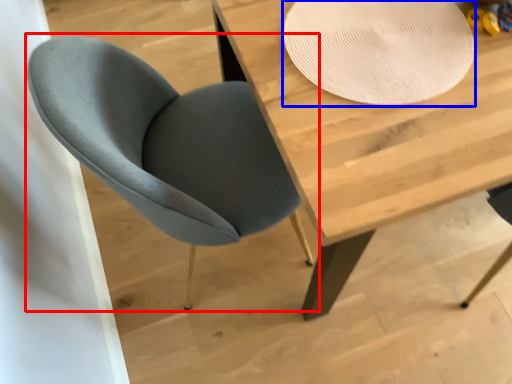
Question: Which object is further to the camera taking this photo, chair (highlighted by a red box) or paper plate (highlighted by a blue box)?

Choices:
 (A) chair
 (B) paper plate

Answer: (B)